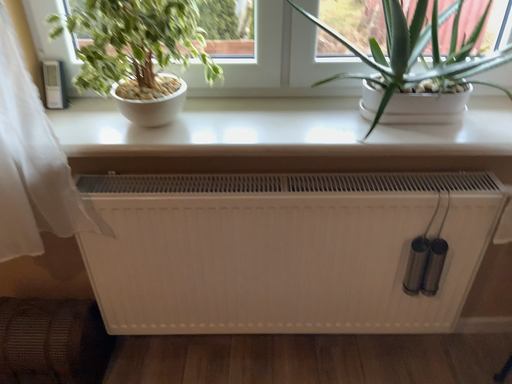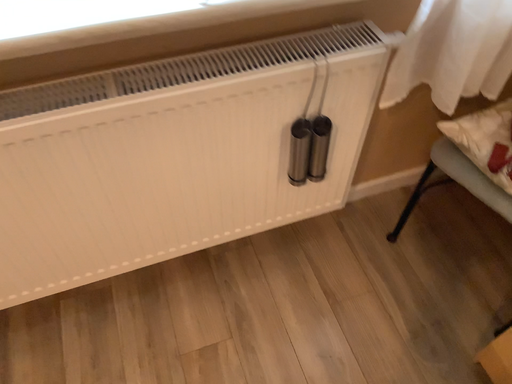
Question: How did the camera likely rotate when shooting the video?

Choices:
 (A) rotated upward
 (B) rotated downward

Answer: (B)